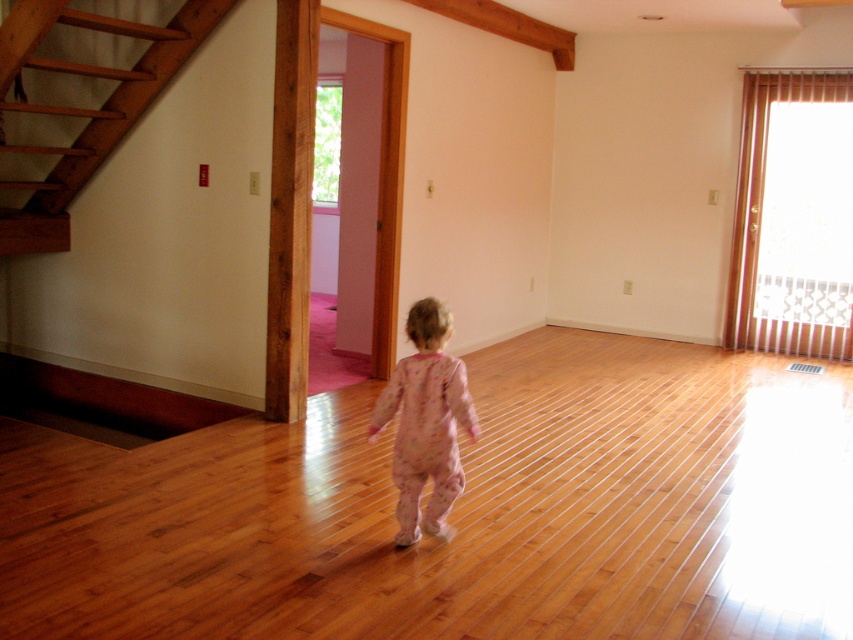
Question: Is wooden stairs at left wider than pink cotton pajamas at center?

Choices:
 (A) no
 (B) yes

Answer: (B)

Question: Can you confirm if wooden stairs at left is positioned to the right of pink cotton pajamas at center?

Choices:
 (A) no
 (B) yes

Answer: (A)

Question: Can you confirm if wooden stairs at left is smaller than pink cotton pajamas at center?

Choices:
 (A) no
 (B) yes

Answer: (A)